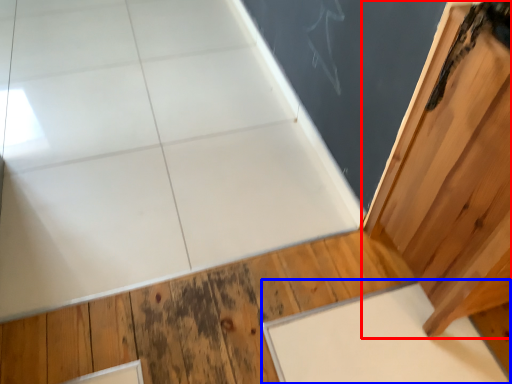
Question: Among these objects, which one is farthest to the camera, door (highlighted by a red box) or slate (highlighted by a blue box)?

Choices:
 (A) door
 (B) slate

Answer: (B)